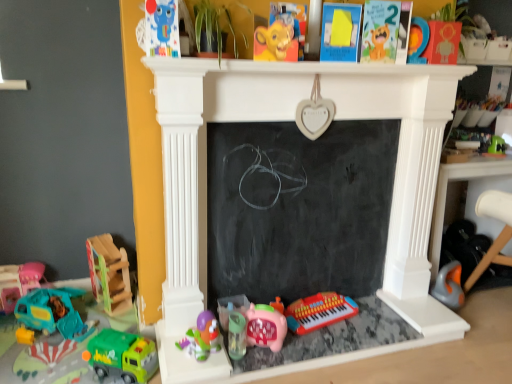
You are a GUI agent. You are given a task and a screenshot of the screen. Output one action in this format:
    pyautogui.click(x=<x>, y=<y>)
    Task: Click on the vacant area that is situated to the right of plastic red keyboard at lower center, which ranks as the 4th toy in right-to-left order
    The width and height of the screenshot is (512, 384).
    Given the screenshot: What is the action you would take?
    pyautogui.click(x=381, y=321)